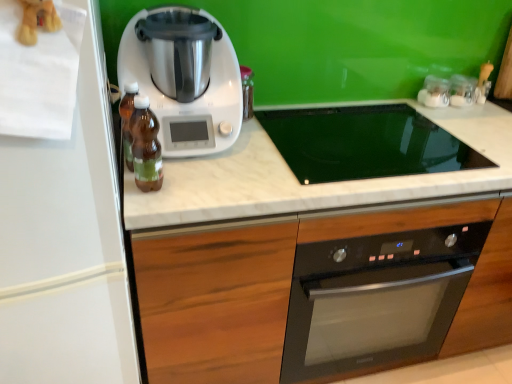
Question: In terms of size, does white marble countertop at center appear bigger or smaller than wooden cabinet at center?

Choices:
 (A) big
 (B) small

Answer: (B)

Question: Considering the relative positions of white marble countertop at center and wooden cabinet at center in the image provided, is white marble countertop at center to the left or to the right of wooden cabinet at center?

Choices:
 (A) left
 (B) right

Answer: (A)

Question: Which is nearer to the brown glass bottle at left, positioned as the 2th bottle in front-to-back order?

Choices:
 (A) clear glass jars at upper right, which ranks as the second appliance in left-to-right order
 (B) wooden cabinet at center
 (C) white marble countertop at center
 (D) white matte refrigerator at left
 (E) clear glass jars at upper right, which appears as the first appliance when viewed from the left

Answer: (D)

Question: Based on their relative distances, which object is farther from the brown glass bottle at left, which is the 1th bottle in back-to-front order?

Choices:
 (A) clear glass jars at upper right, the 2th appliance when ordered from right to left
 (B) white plastic kitchen appliance at center
 (C) brown glass bottle at center, marked as the second bottle in a back-to-front arrangement
 (D) clear glass jars at upper right, which ranks as the second appliance in left-to-right order
 (E) white marble countertop at center

Answer: (D)